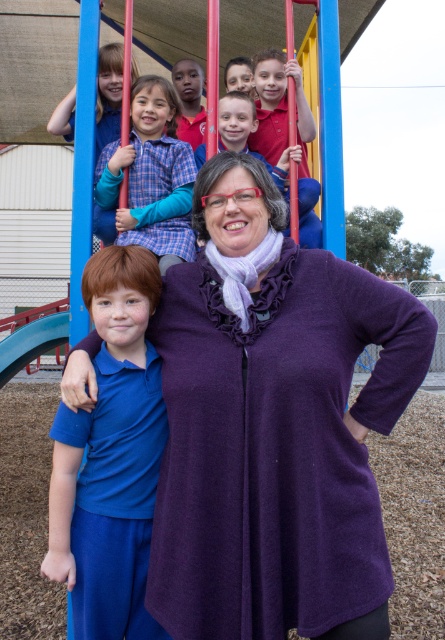
Question: Considering the real-world distances, which object is farthest from the matte red shirt at upper center?

Choices:
 (A) plaid shirt at upper center
 (B) blue fabric shirt at center

Answer: (B)

Question: Does blue fabric shirt at center come in front of matte blue shirt at center?

Choices:
 (A) yes
 (B) no

Answer: (A)

Question: Is the position of matte red shirt at upper center less distant than that of matte blue shirt at center?

Choices:
 (A) no
 (B) yes

Answer: (B)

Question: Which object is farther from the camera taking this photo?

Choices:
 (A) blue fabric shirt at center
 (B) purple fleece sweater at center
 (C) matte red shirt at upper center

Answer: (C)

Question: Does plaid shirt at upper center appear on the right side of matte red shirt at upper center?

Choices:
 (A) no
 (B) yes

Answer: (A)

Question: Considering the real-world distances, which object is closest to the plaid shirt at upper center?

Choices:
 (A) matte blue shirt at center
 (B) purple fleece sweater at center
 (C) matte red shirt at upper center
 (D) blue fabric shirt at center

Answer: (C)